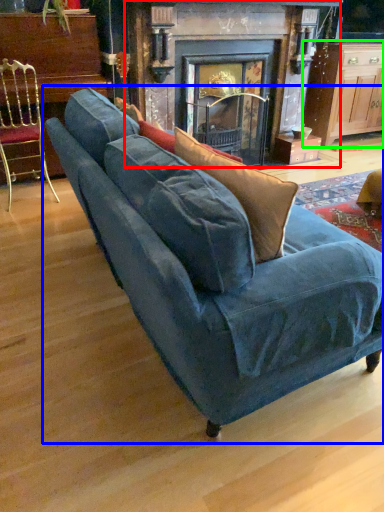
Question: Which object is positioned farthest from fireplace (highlighted by a red box)? Select from studio couch (highlighted by a blue box) and table (highlighted by a green box).

Choices:
 (A) studio couch
 (B) table

Answer: (A)